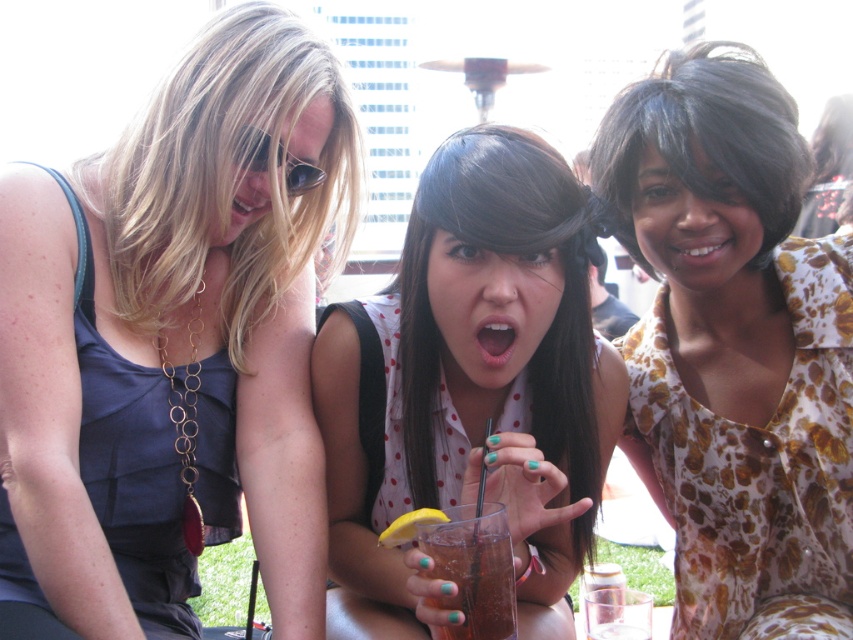
Which woman is wearing the matte black dress at left?

The woman on the left is wearing the matte black dress at left.

Consider the image. Based on the coordinates provided, which woman does the point at (x=705, y=141) correspond to?

The point at (x=705, y=141) corresponds to the woman with dark brown hair at upper right.

You are standing at the camera position and want to throw a small ball to a friend who is at point (546, 580). There is an obstacle at point (225, 102). Will the obstacle block your direct path to the target?

Point (225, 102) is closer to the camera than point (546, 580), so the obstacle at point (225, 102) will block your direct path to the target at point (546, 580).